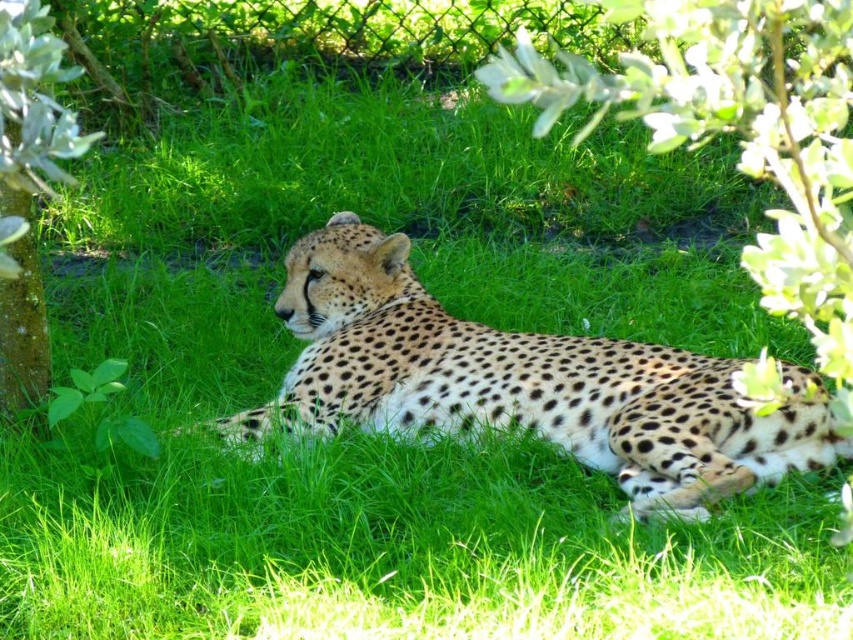
Who is positioned more to the right, spotted fur cheetah at center or green leafy bush at left?

From the viewer's perspective, spotted fur cheetah at center appears more on the right side.

Which is above, spotted fur cheetah at center or green leafy bush at left?

green leafy bush at left is above.

Is point (514, 337) positioned in front of point (61, 72)?

No, it is behind (61, 72).

In order to click on spotted fur cheetah at center in this screenshot , I will do `click(520, 384)`.